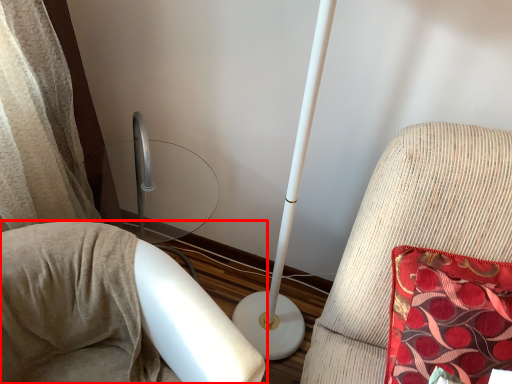
Question: Where is furniture (annotated by the red box) located in relation to furniture in the image?

Choices:
 (A) right
 (B) left

Answer: (B)